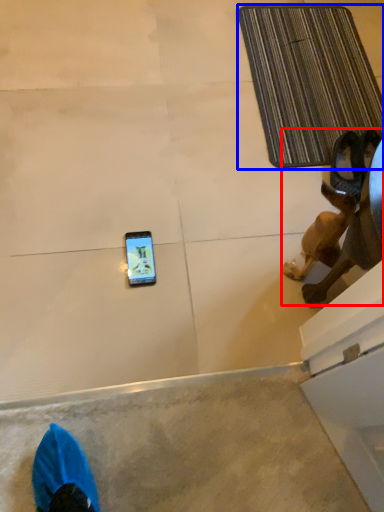
Question: Which of the following is the farthest to the observer, animal (highlighted by a red box) or bath mat (highlighted by a blue box)?

Choices:
 (A) animal
 (B) bath mat

Answer: (B)